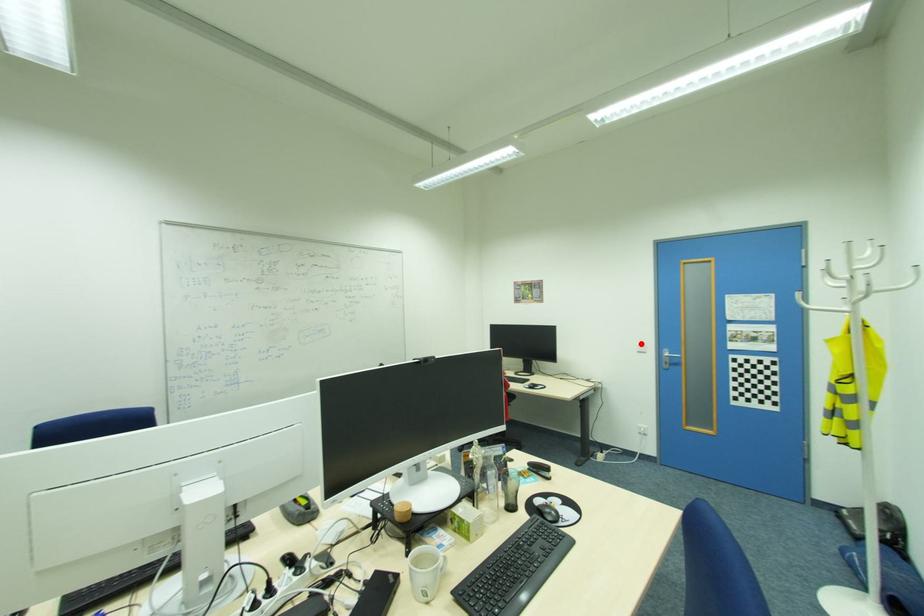
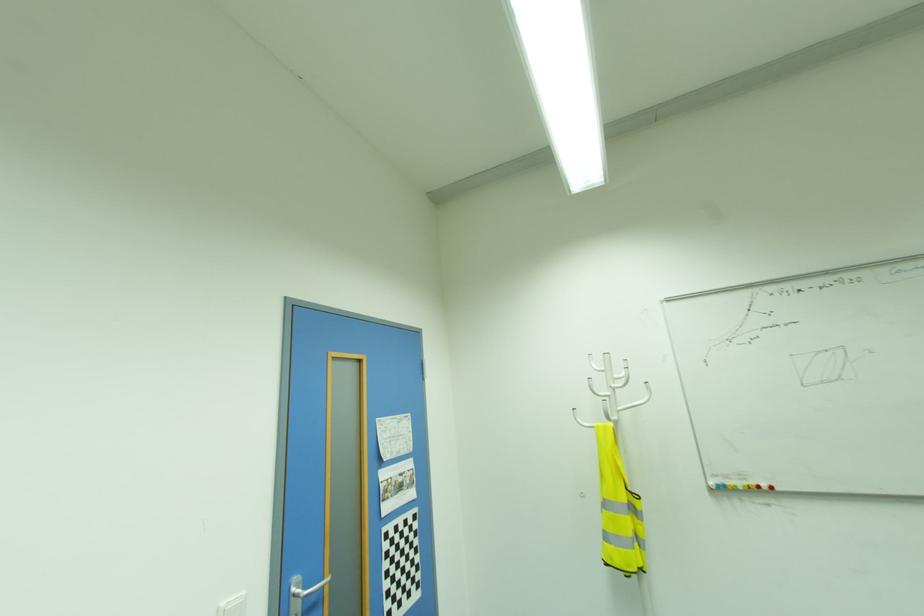
Find the pixel in the second image that matches the highlighted location in the first image.

(226, 602)